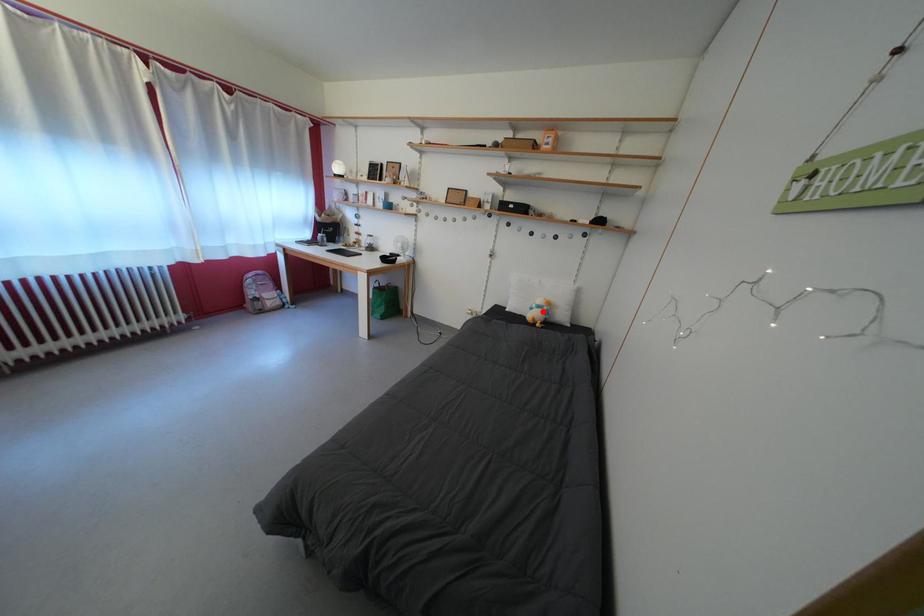
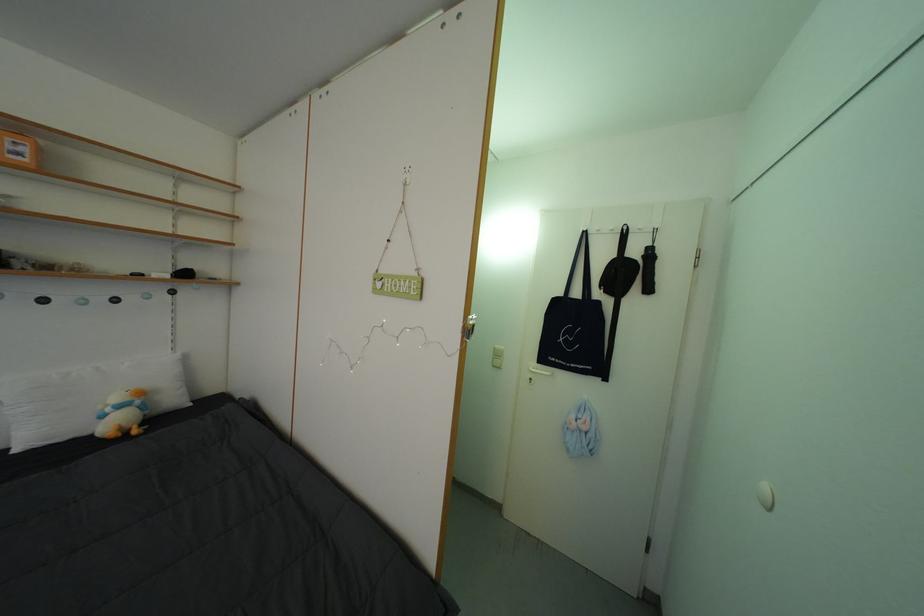
Find the pixel in the second image that matches the highlighted location in the first image.

(117, 415)